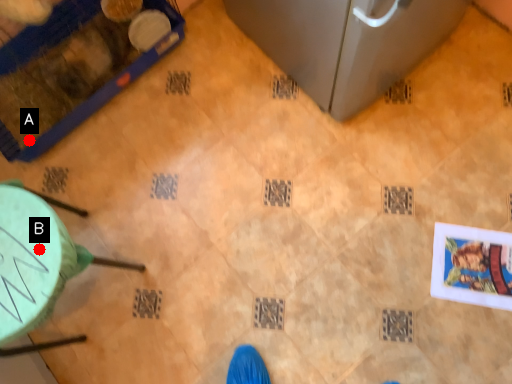
Question: Two points are circled on the image, labeled by A and B beside each circle. Which point appears farthest from the camera in this image?

Choices:
 (A) A is further
 (B) B is further

Answer: (A)